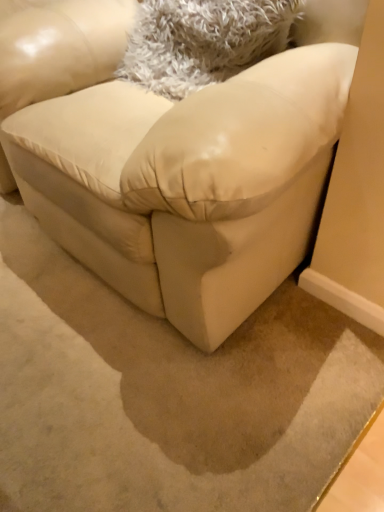
Question: Is white fluffy pillow at upper center bigger than matte cream couch at center?

Choices:
 (A) yes
 (B) no

Answer: (B)

Question: From a real-world perspective, is white fluffy pillow at upper center located higher than matte cream couch at center?

Choices:
 (A) no
 (B) yes

Answer: (B)

Question: From a real-world perspective, is white fluffy pillow at upper center positioned under matte cream couch at center based on gravity?

Choices:
 (A) yes
 (B) no

Answer: (B)

Question: Can you confirm if white fluffy pillow at upper center is taller than matte cream couch at center?

Choices:
 (A) yes
 (B) no

Answer: (B)

Question: From the image's perspective, is white fluffy pillow at upper center on top of matte cream couch at center?

Choices:
 (A) no
 (B) yes

Answer: (B)

Question: Could you tell me if white fluffy pillow at upper center is facing matte cream couch at center?

Choices:
 (A) no
 (B) yes

Answer: (B)

Question: Is matte cream couch at center to the left of white fluffy pillow at upper center from the viewer's perspective?

Choices:
 (A) yes
 (B) no

Answer: (A)

Question: Is matte cream couch at center taller than white fluffy pillow at upper center?

Choices:
 (A) no
 (B) yes

Answer: (B)

Question: Is matte cream couch at center oriented towards white fluffy pillow at upper center?

Choices:
 (A) yes
 (B) no

Answer: (A)

Question: From the image's perspective, would you say matte cream couch at center is positioned over white fluffy pillow at upper center?

Choices:
 (A) no
 (B) yes

Answer: (A)

Question: Can you confirm if matte cream couch at center is bigger than white fluffy pillow at upper center?

Choices:
 (A) yes
 (B) no

Answer: (A)

Question: From a real-world perspective, does matte cream couch at center stand above white fluffy pillow at upper center?

Choices:
 (A) no
 (B) yes

Answer: (A)

Question: From the image's perspective, relative to white fluffy pillow at upper center, is matte cream couch at center above or below?

Choices:
 (A) below
 (B) above

Answer: (A)